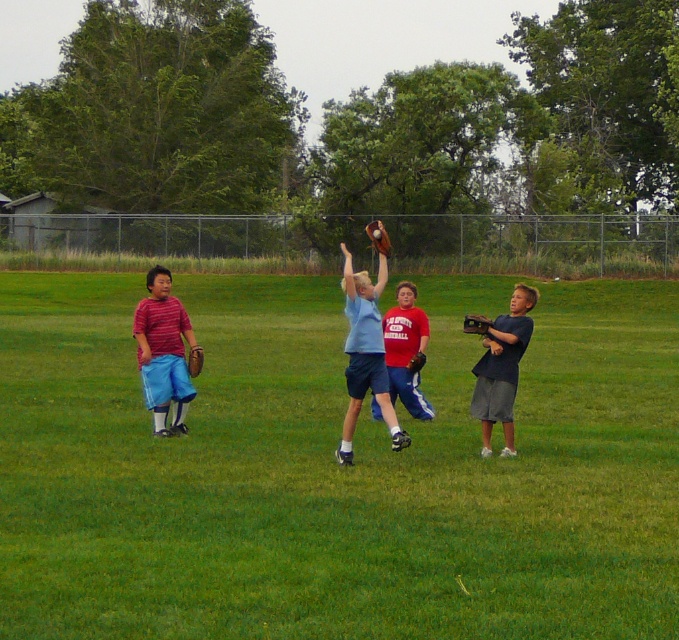
You are a coach observing the baseball game. You want to ensure the players maintain a safe distance of at least 5 meters between them to prevent collisions. Are the light blue jersey at center and dark blue jersey at right positioned safely apart from each other?

The light blue jersey at center and dark blue jersey at right are 4.92 meters apart from each other, which is slightly less than the required 5 meters. Therefore, they are not positioned safely apart according to the coach requirement.

You are a photographer standing at the edge of the baseball field. You want to take a photo that includes both the light blue jersey at center and the brown leather glove at upper center. Which object should you focus on first if you want to ensure both are in the frame?

The light blue jersey at center is much taller than the brown leather glove at upper center, so you should focus on the light blue jersey at center first to ensure both are in the frame.